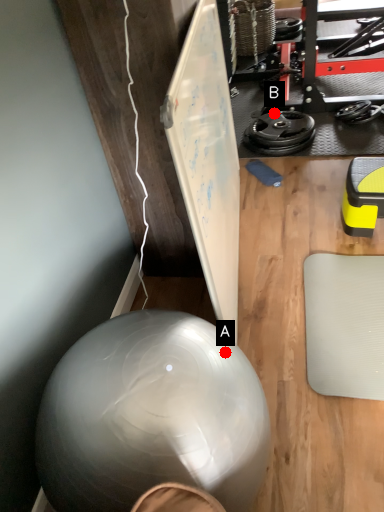
Question: Two points are circled on the image, labeled by A and B beside each circle. Which point is closer to the camera taking this photo?

Choices:
 (A) A is closer
 (B) B is closer

Answer: (A)